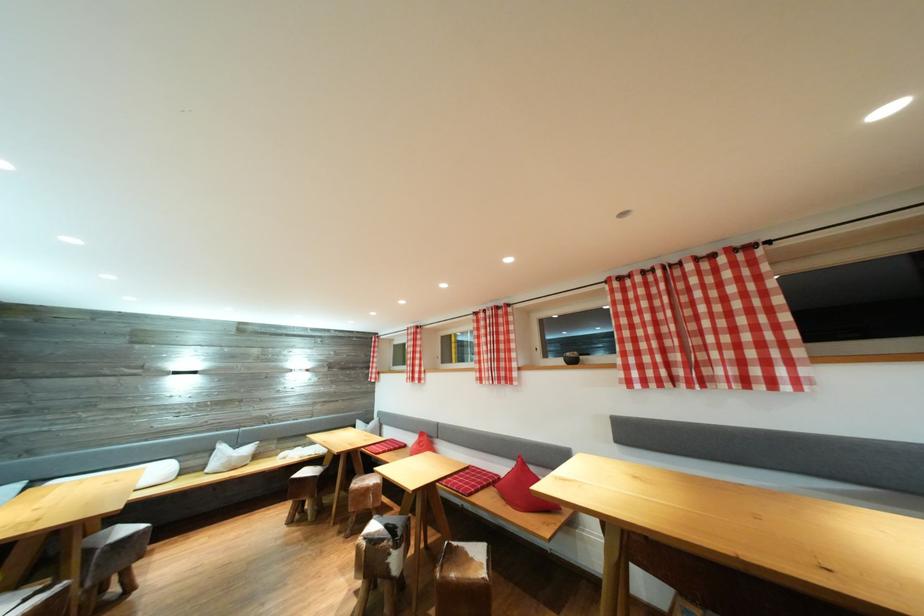
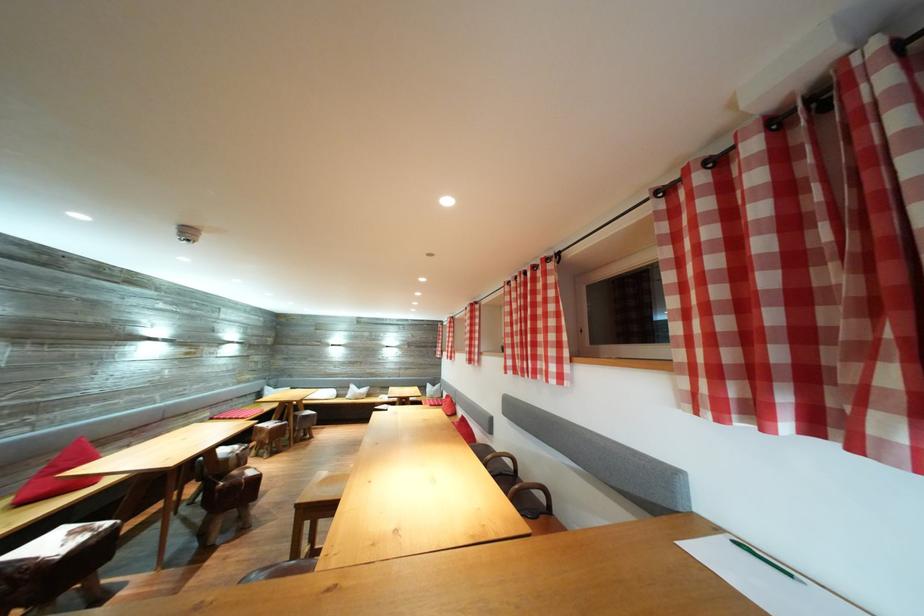
Locate, in the second image, the point that corresponds to (262,462) in the first image.

(375, 400)